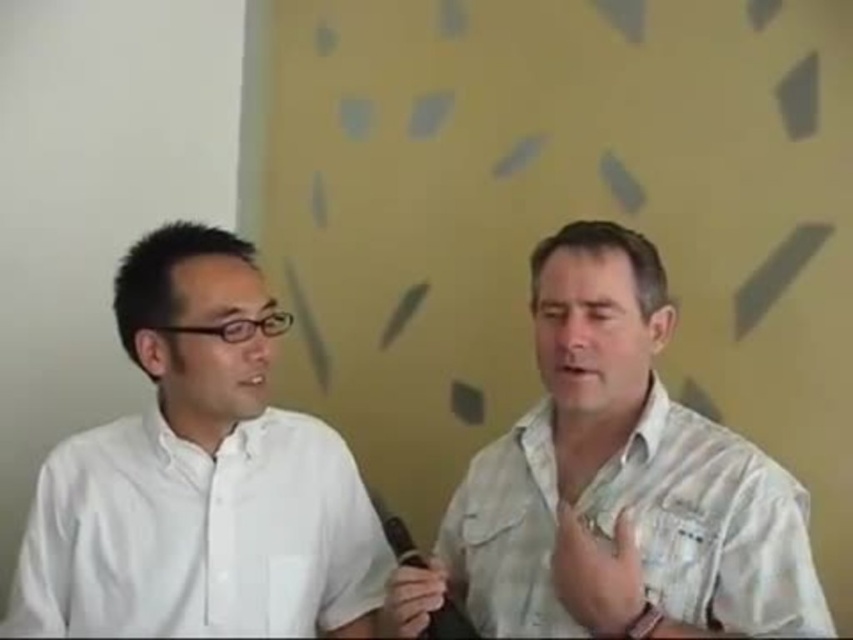
Who is taller, white smooth shirt at left or black rubber microphone at center?

white smooth shirt at left is taller.

Is white smooth shirt at left wider than black rubber microphone at center?

Correct, the width of white smooth shirt at left exceeds that of black rubber microphone at center.

Is point (291, 544) positioned behind point (463, 628)?

Yes, it is.

At what (x,y) coordinates should I click in order to perform the action: click on white smooth shirt at left. Please return your answer as a coordinate pair (x, y). The width and height of the screenshot is (853, 640). Looking at the image, I should click on (199, 477).

Who is positioned more to the left, white textured shirt at center or black rubber microphone at center?

black rubber microphone at center

Looking at this image, which is below, white textured shirt at center or black rubber microphone at center?

black rubber microphone at center is below.

Between point (399, 573) and point (440, 636), which one is positioned in front?

Point (440, 636)

The height and width of the screenshot is (640, 853). I want to click on white textured shirt at center, so [x=616, y=484].

Does point (802, 488) come closer to viewer compared to point (143, 545)?

Yes, it is.

Based on the photo, does white textured shirt at center appear on the right side of white smooth shirt at left?

Indeed, white textured shirt at center is positioned on the right side of white smooth shirt at left.

Is point (679, 435) positioned after point (212, 397)?

That is False.

Find the location of a particular element. The height and width of the screenshot is (640, 853). white textured shirt at center is located at coordinates (616, 484).